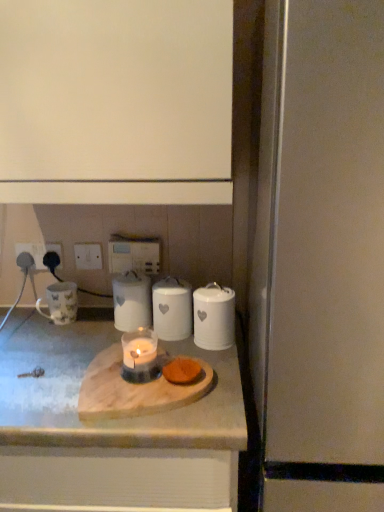
Identify the location of vacant space that is in between white ceramic candle at center, which appears as the 4th appliance when viewed from the right, and white glossy mug at left, which appears as the 5th appliance when viewed from the right. This screenshot has height=512, width=384. (92, 324).